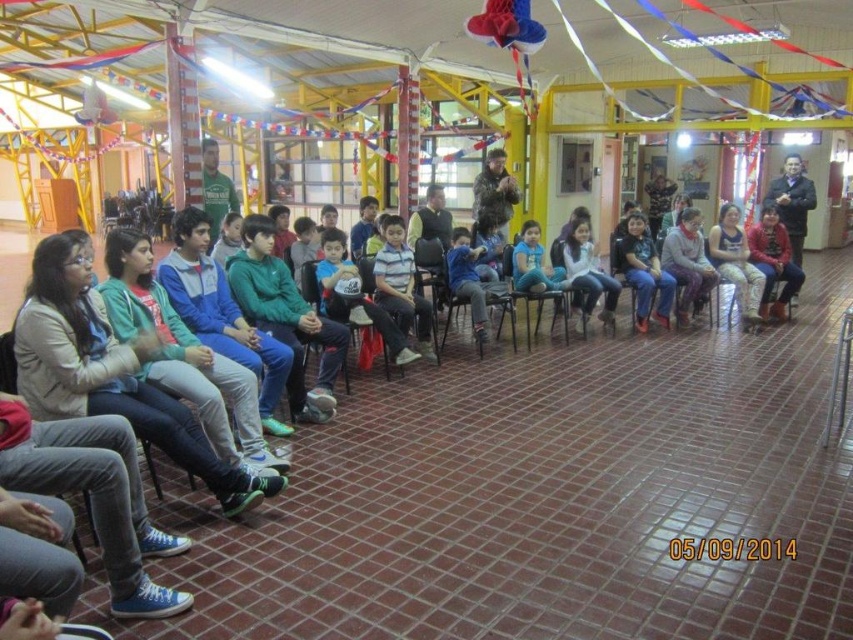
Is light gray sweater at center thinner than black plastic chair at center?

Yes, light gray sweater at center is thinner than black plastic chair at center.

Can you confirm if light gray sweater at center is positioned below black plastic chair at center?

No, light gray sweater at center is not below black plastic chair at center.

What do you see at coordinates (688, 262) in the screenshot?
I see `light gray sweater at center` at bounding box center [688, 262].

This screenshot has height=640, width=853. What are the coordinates of `light gray sweater at center` in the screenshot? It's located at (x=688, y=262).

Can you confirm if matte black shirt at center is positioned below light gray sweater at center?

Correct, matte black shirt at center is located below light gray sweater at center.

Which of these two, matte black shirt at center or light gray sweater at center, stands shorter?

Standing shorter between the two is light gray sweater at center.

Between point (653, 280) and point (663, 243), which one is positioned behind?

The point (663, 243) is more distant.

Find the location of `matte black shirt at center`. matte black shirt at center is located at coordinates (643, 272).

From the picture: Who is positioned more to the left, fuzzy brown jacket at upper center or green fabric shirt at upper center?

green fabric shirt at upper center

Is the position of fuzzy brown jacket at upper center less distant than that of green fabric shirt at upper center?

No, it is behind green fabric shirt at upper center.

Who is more distant from viewer, [491,156] or [225,202]?

The point [491,156] is more distant.

Where is `fuzzy brown jacket at upper center`? fuzzy brown jacket at upper center is located at coordinates (494, 192).